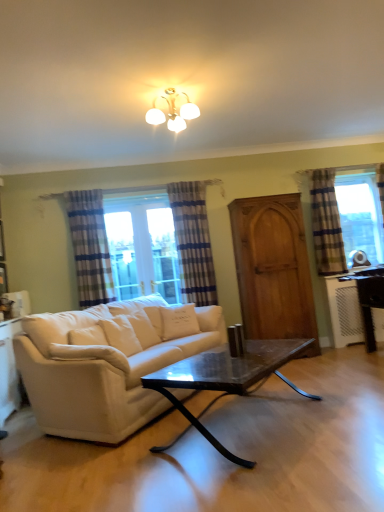
Find the location of `space that is in front of marble black coffee table at center`. space that is in front of marble black coffee table at center is located at coordinates click(261, 477).